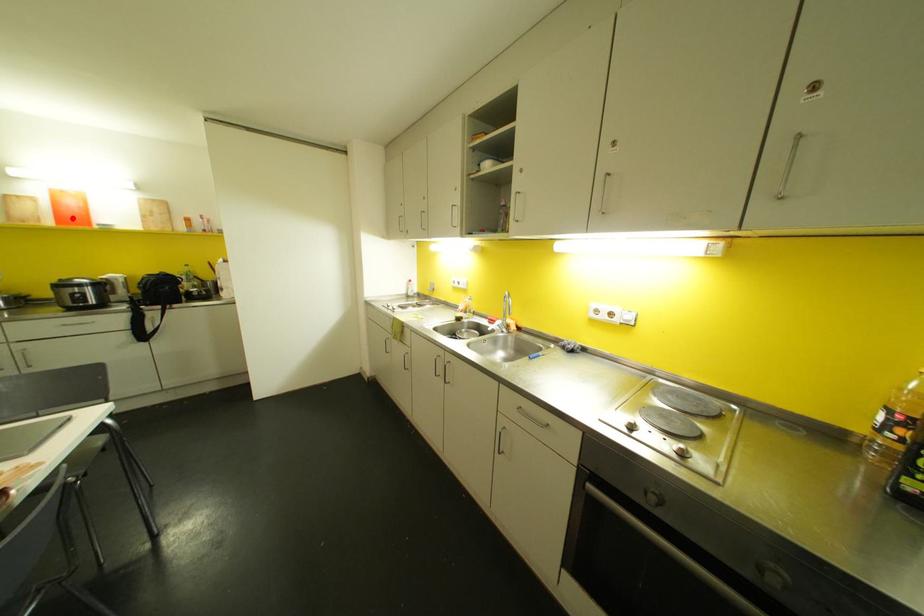
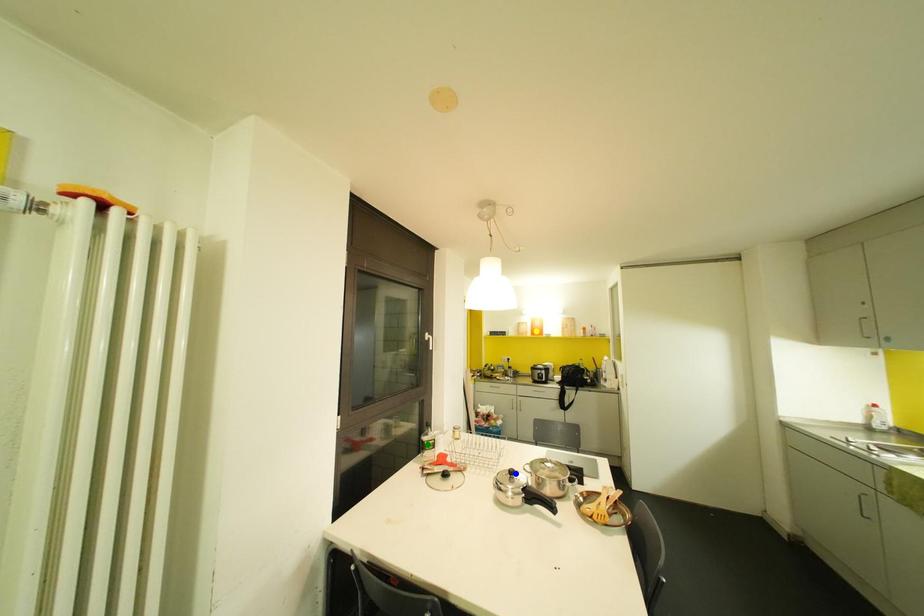
Question: I am providing you with two images of the same scene from different viewpoints. A red point is marked on the first image. You are given multiple points on the second image. Which point in image 2 is actually the same real-world point as the red point in image 1?

Choices:
 (A) yellow point
 (B) green point
 (C) blue point

Answer: (A)